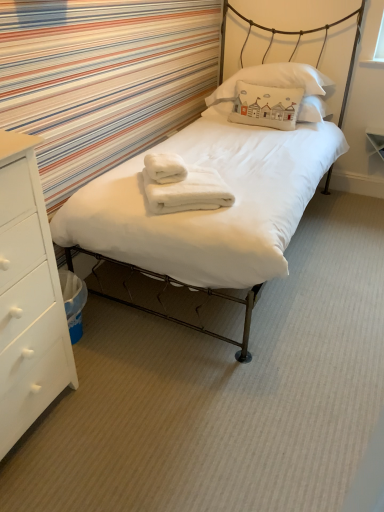
Question: From a real-world perspective, is white cotton pillow at upper center, which is counted as the 2th pillow, starting from the top, on white cotton pillow at upper center, the second pillow in the bottom-to-top sequence?

Choices:
 (A) yes
 (B) no

Answer: (B)

Question: From the image's perspective, would you say white cotton pillow at upper center, the 1th pillow ordered from the bottom, is positioned over white cotton pillow at upper center, the second pillow in the bottom-to-top sequence?

Choices:
 (A) yes
 (B) no

Answer: (B)

Question: Does white cotton pillow at upper center, which is counted as the 2th pillow, starting from the top, appear on the left side of white cotton pillow at upper center, the 1th pillow from the top?

Choices:
 (A) no
 (B) yes

Answer: (B)

Question: Is white cotton pillow at upper center, the 1th pillow ordered from the bottom, placed right next to white cotton pillow at upper center, the second pillow in the bottom-to-top sequence?

Choices:
 (A) yes
 (B) no

Answer: (B)

Question: Is white cotton pillow at upper center, which is counted as the 2th pillow, starting from the top, turned away from white cotton pillow at upper center, the 1th pillow from the top?

Choices:
 (A) yes
 (B) no

Answer: (A)

Question: From a real-world perspective, relative to white cotton pillow at upper center, the 1th pillow ordered from the bottom, is white fluffy bath towel at center, acting as the first bath towel starting from the top, vertically above or below?

Choices:
 (A) above
 (B) below

Answer: (B)

Question: Is white fluffy bath towel at center, placed as the 2th bath towel when sorted from bottom to top, to the left or to the right of white cotton pillow at upper center, the 1th pillow ordered from the bottom, in the image?

Choices:
 (A) right
 (B) left

Answer: (B)

Question: Considering the positions of white fluffy bath towel at center, placed as the 2th bath towel when sorted from bottom to top, and white cotton pillow at upper center, the 1th pillow ordered from the bottom, in the image, is white fluffy bath towel at center, placed as the 2th bath towel when sorted from bottom to top, wider or thinner than white cotton pillow at upper center, the 1th pillow ordered from the bottom,?

Choices:
 (A) thin
 (B) wide

Answer: (B)

Question: Based on their sizes in the image, would you say white fluffy bath towel at center, acting as the first bath towel starting from the top, is bigger or smaller than white cotton pillow at upper center, the 1th pillow ordered from the bottom?

Choices:
 (A) big
 (B) small

Answer: (B)

Question: In terms of size, does white cotton pillow at upper center, the 1th pillow ordered from the bottom, appear bigger or smaller than white matte chest of drawers at left?

Choices:
 (A) big
 (B) small

Answer: (B)

Question: Considering their positions, is white cotton pillow at upper center, which is counted as the 2th pillow, starting from the top, located in front of or behind white matte chest of drawers at left?

Choices:
 (A) behind
 (B) front

Answer: (A)

Question: Looking at their shapes, would you say white cotton pillow at upper center, which is counted as the 2th pillow, starting from the top, is wider or thinner than white matte chest of drawers at left?

Choices:
 (A) wide
 (B) thin

Answer: (B)

Question: Would you say white cotton pillow at upper center, the 1th pillow ordered from the bottom, is inside or outside white matte chest of drawers at left?

Choices:
 (A) outside
 (B) inside

Answer: (A)

Question: In the image, is white fluffy bath towel at center, which ranks as the 2th bath towel in top-to-bottom order, on the left side or the right side of white cotton pillow at upper center, the 1th pillow from the top?

Choices:
 (A) left
 (B) right

Answer: (A)

Question: Considering their positions, is white fluffy bath towel at center, which appears as the first bath towel when ordered from the bottom, located in front of or behind white cotton pillow at upper center, the second pillow in the bottom-to-top sequence?

Choices:
 (A) front
 (B) behind

Answer: (A)